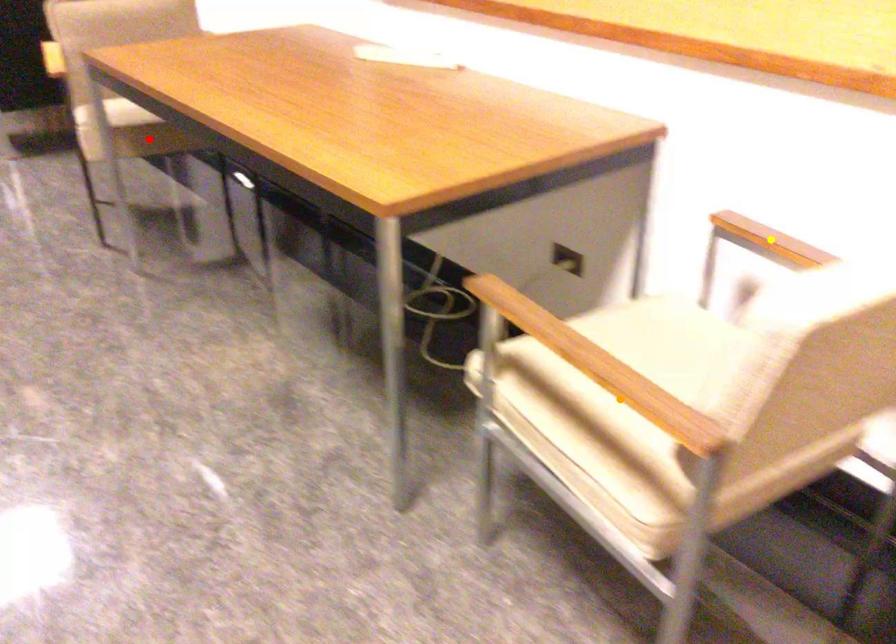
Order these from nearest to farthest:
- yellow point
- red point
- orange point

orange point → yellow point → red point